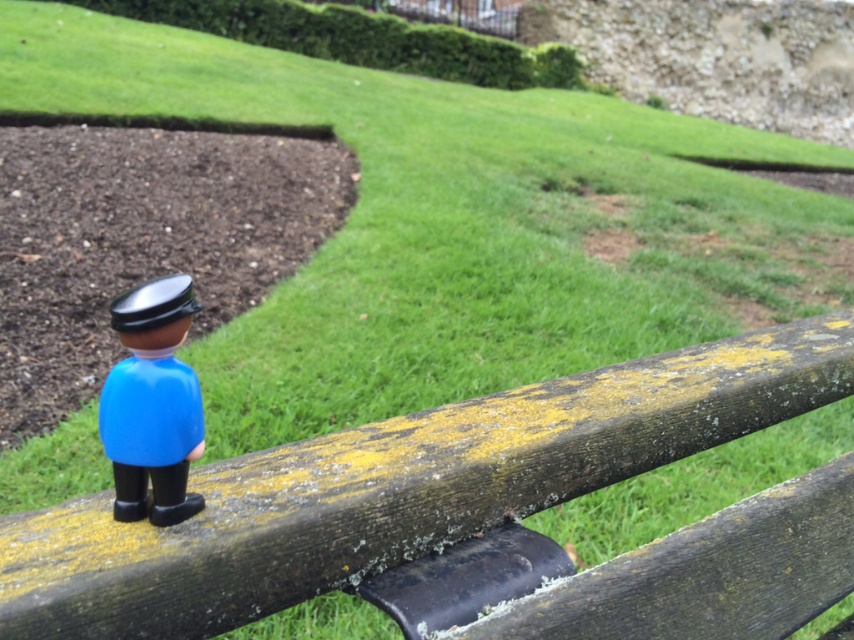
You are standing in front of the wooden railing where the figurine is placed. You notice two points marked on the railing. Which point is closer to you, point (x=325, y=512) or point (x=159, y=442)?

Point (x=325, y=512) is further to the viewer than point (x=159, y=442), so the closer point to you is point (x=159, y=442).

You are trying to place a new small plant pot between the wooden fence at center and the blue plastic figurine at lower left. Given that the plant pot is 10 cm wide, can you fit it there based on their widths?

The wooden fence at center is wider than the blue plastic figurine at lower left. However, the exact width difference isn

You are standing in a garden and see the wooden fence at center and the blue plastic figurine at lower left. Which object is positioned to the right of the other?

The wooden fence at center is to the right of the blue plastic figurine at lower left.